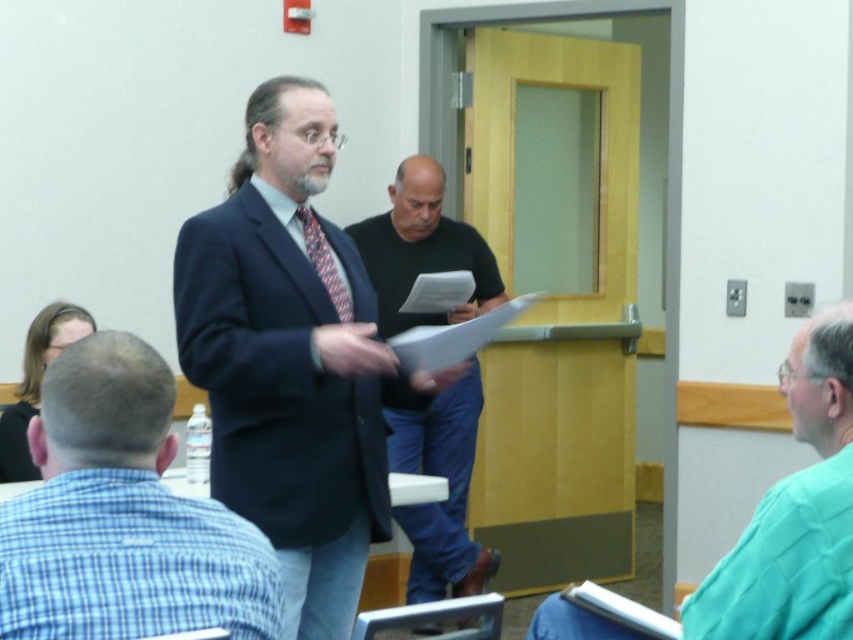
Who is more distant from viewer, (x=840, y=348) or (x=460, y=432)?

Positioned behind is point (x=460, y=432).

You are a GUI agent. You are given a task and a screenshot of the screen. Output one action in this format:
    pyautogui.click(x=<x>, y=<y>)
    Task: Click on the green fabric shirt at right
    
    Given the screenshot: What is the action you would take?
    pyautogui.click(x=795, y=513)

This screenshot has height=640, width=853. What do you see at coordinates (795, 513) in the screenshot?
I see `green fabric shirt at right` at bounding box center [795, 513].

Identify the location of green fabric shirt at right. (795, 513).

The width and height of the screenshot is (853, 640). Describe the element at coordinates (289, 358) in the screenshot. I see `matte black suit at center` at that location.

Consider the image. Is matte black suit at center thinner than white paper at center?

No, matte black suit at center is not thinner than white paper at center.

Is point (392, 385) less distant than point (495, 333)?

Yes, it is.

Where is `matte black suit at center`? This screenshot has width=853, height=640. matte black suit at center is located at coordinates (289, 358).

Which is in front, point (421, 168) or point (318, 276)?

Point (318, 276) is more forward.

Between point (436, 228) and point (332, 300), which one is positioned behind?

Positioned behind is point (436, 228).

The image size is (853, 640). Find the location of `black cotton shirt at center`. black cotton shirt at center is located at coordinates (448, 490).